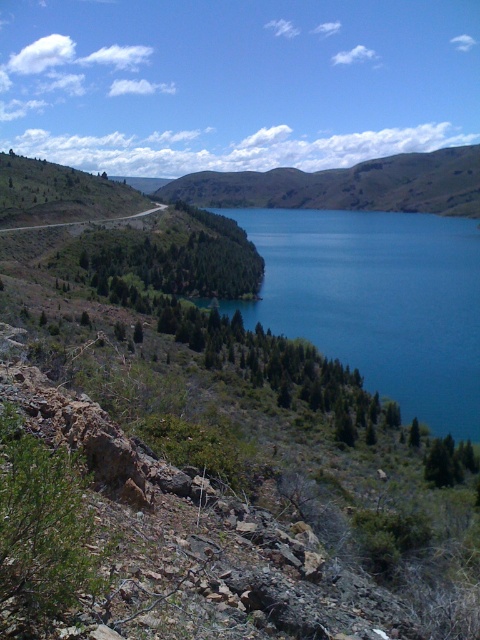
Is blue glossy water at center below green grassy hillside at center?

Answer: Yes.

From the picture: Is blue glossy water at center to the left of green grassy hillside at center from the viewer's perspective?

Correct, you'll find blue glossy water at center to the left of green grassy hillside at center.

The height and width of the screenshot is (640, 480). In order to click on blue glossy water at center in this screenshot , I will do `click(377, 301)`.

Who is shorter, blue glossy water at center or gray asphalt road at center?

With less height is gray asphalt road at center.

Does blue glossy water at center have a lesser width compared to gray asphalt road at center?

No.

Is point (380, 308) less distant than point (130, 216)?

Yes, point (380, 308) is in front of point (130, 216).

Find the location of a particular element. Image resolution: width=480 pixels, height=640 pixels. blue glossy water at center is located at coordinates (377, 301).

Is point (257, 192) less distant than point (148, 212)?

No, it is behind (148, 212).

Identify the location of green grassy hillside at center. The width and height of the screenshot is (480, 640). (347, 186).